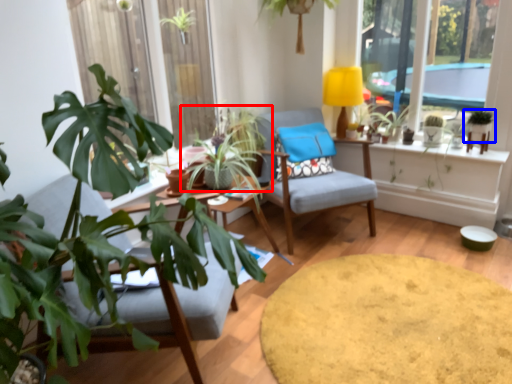
Question: Among these objects, which one is farthest to the camera, houseplant (highlighted by a red box) or houseplant (highlighted by a blue box)?

Choices:
 (A) houseplant
 (B) houseplant

Answer: (A)